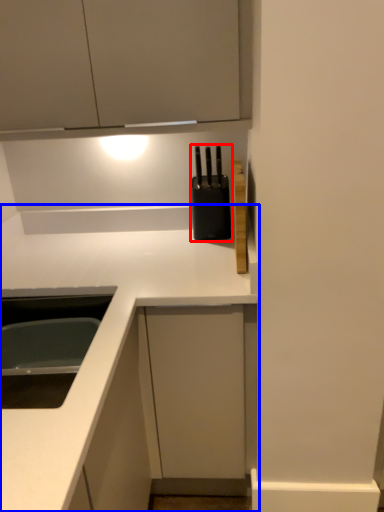
Question: Which object appears closest to the camera in this image, appliance (highlighted by a red box) or countertop (highlighted by a blue box)?

Choices:
 (A) appliance
 (B) countertop

Answer: (B)